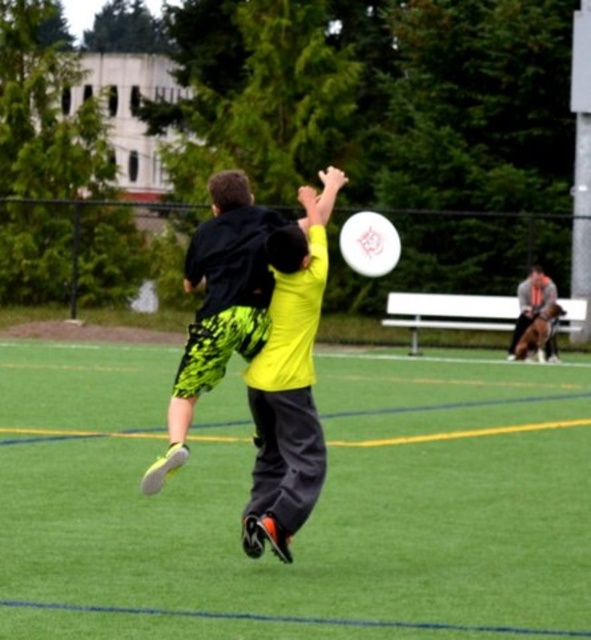
Does green artificial turf at center have a smaller size compared to white matte frisbee at center?

Incorrect, green artificial turf at center is not smaller in size than white matte frisbee at center.

Does green artificial turf at center appear over white matte frisbee at center?

No.

Which is behind, point (346, 490) or point (391, 252)?

The point (391, 252) is behind.

The height and width of the screenshot is (640, 591). Identify the location of green artificial turf at center. (310, 515).

Does green artificial turf at center lie behind neon yellow jersey at center?

No, it is in front of neon yellow jersey at center.

Which is in front, point (424, 461) or point (275, 273)?

Point (275, 273) is more forward.

Find the location of a particular element. green artificial turf at center is located at coordinates (310, 515).

Does neon yellow jersey at center appear on the left side of white matte frisbee at center?

Correct, you'll find neon yellow jersey at center to the left of white matte frisbee at center.

Is neon yellow jersey at center positioned behind white matte frisbee at center?

No, neon yellow jersey at center is in front of white matte frisbee at center.

Who is more distant from viewer, (280, 484) or (361, 243)?

The point (361, 243) is behind.

Identify the location of neon yellow jersey at center. (287, 387).